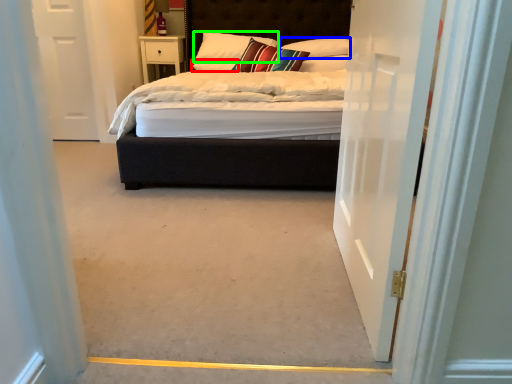
Question: Considering the real-world distances, which object is farthest from pillow (highlighted by a red box)? pillow (highlighted by a blue box) or pillow (highlighted by a green box)?

Choices:
 (A) pillow
 (B) pillow

Answer: (A)